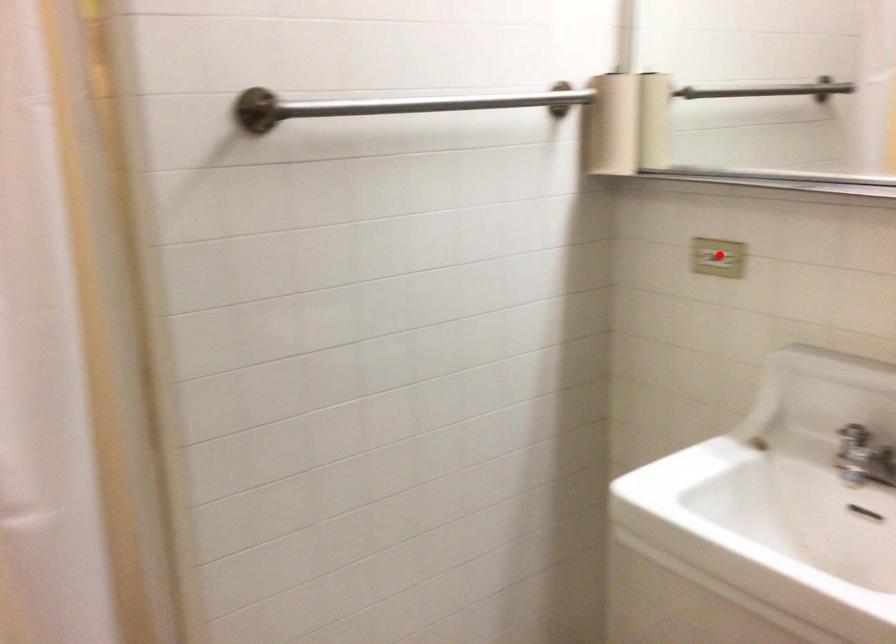
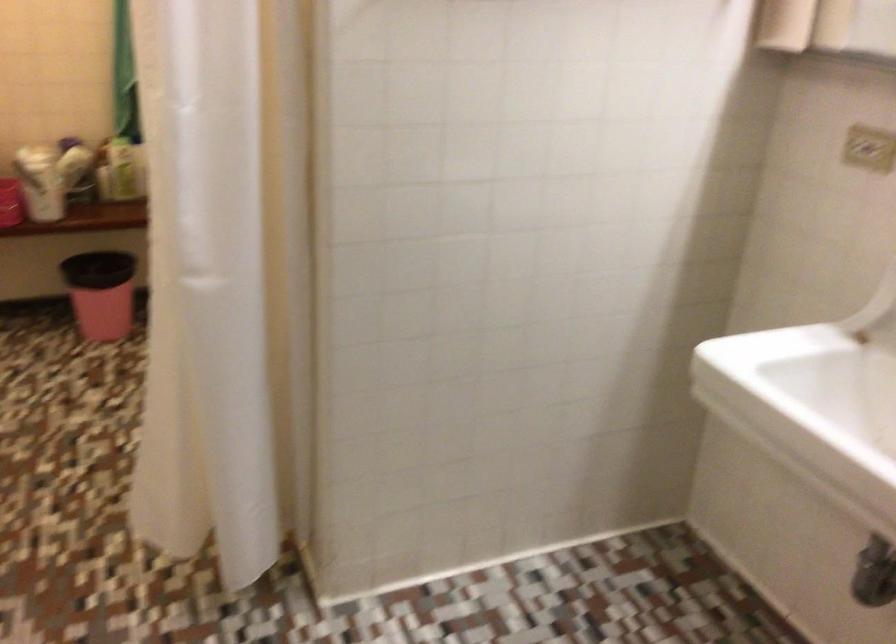
In the second image, find the point that corresponds to the highlighted location in the first image.

(867, 147)